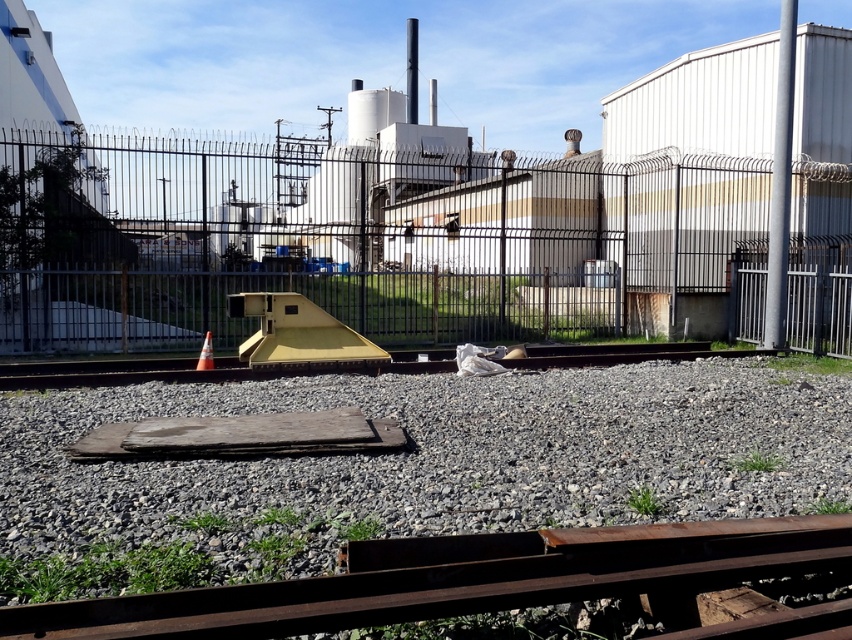
You are a delivery driver approaching the industrial area shown in the image. You need to determine the correct path to take. Based on the scene, which object is closer to you, the metallic wire mesh fence at center or the rusty metal train track at lower center?

The metallic wire mesh fence at center is closer to you than the rusty metal train track at lower center because it is further to the viewer, meaning it is positioned nearer in the scene.

You are a delivery driver approaching the industrial area shown in the image. You notice the gray gravel at center and the orange reflective cone at center. Which object would you see first as you drive towards them?

The gray gravel at center is in front of the orange reflective cone at center, so you would see the gray gravel at center first as you drive towards them.

You are a construction worker who needs to place a 2.5 meter long safety barrier between the gray gravel at center and the rusty metal train track at lower center. Is there enough space to place it without overlapping either object?

The distance between the gray gravel at center and the rusty metal train track at lower center is 2.34 meters. Since the safety barrier is 2.5 meters long, it would require more space than available. Therefore, it cannot be placed without overlapping either object.